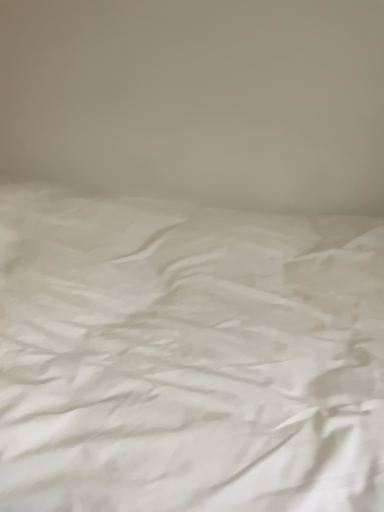
The width and height of the screenshot is (384, 512). What do you see at coordinates (187, 356) in the screenshot?
I see `white satin bed at center` at bounding box center [187, 356].

At what (x,y) coordinates should I click in order to perform the action: click on white satin bed at center. Please return your answer as a coordinate pair (x, y). Looking at the image, I should click on (187, 356).

The image size is (384, 512). In order to click on white satin bed at center in this screenshot , I will do pyautogui.click(x=187, y=356).